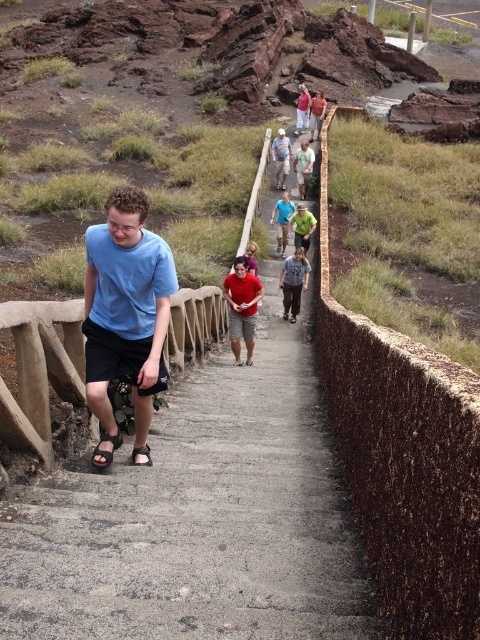
You are standing at the bottom of the concrete stairs at center and want to reach the person wearing the green fabric shirt at center. Which direction should you move relative to the stairs?

The concrete stairs at center is positioned under the green fabric shirt at center, so you should move upward along the concrete stairs at center to reach the person wearing the green fabric shirt at center.

Based on the photo, you are standing at the bottom of the stairs and want to reach the top. Where should you look to find the concrete stairs at center?

The concrete stairs at center are located at point (199, 524).